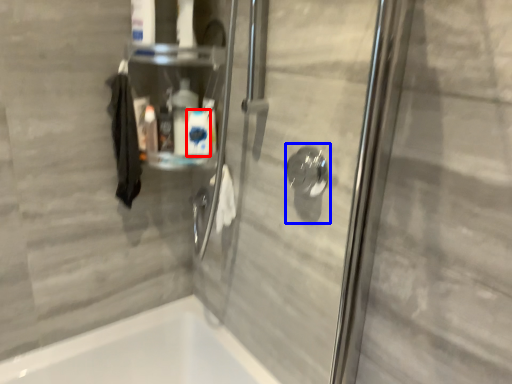
Question: Which of the following is the closest to the observer, cleaning product (highlighted by a red box) or shower (highlighted by a blue box)?

Choices:
 (A) cleaning product
 (B) shower

Answer: (B)